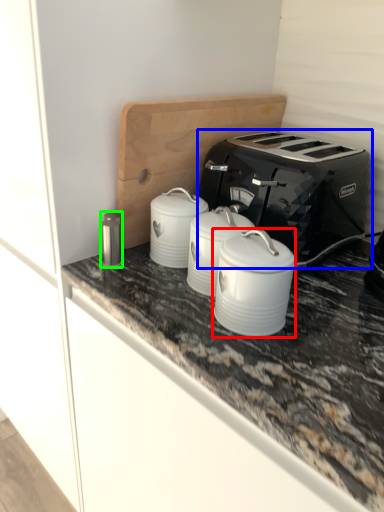
Question: Which object is positioned closest to appliance (highlighted by a red box)? Select from toaster (highlighted by a blue box) and appliance (highlighted by a green box).

Choices:
 (A) toaster
 (B) appliance

Answer: (A)